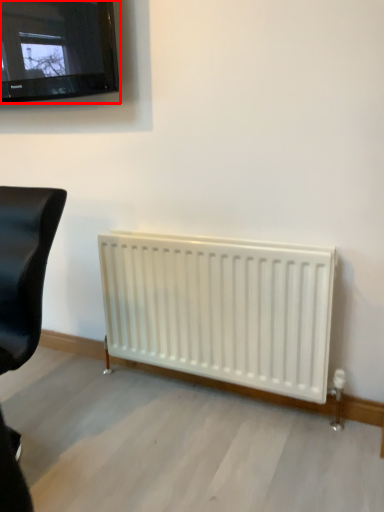
Question: In this image, where is television (annotated by the red box) located relative to furniture?

Choices:
 (A) left
 (B) right

Answer: (B)